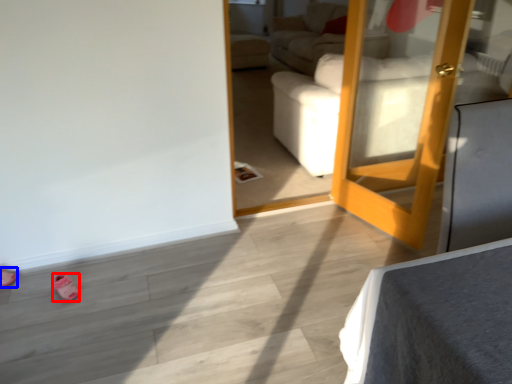
Question: Which object appears farthest to the camera in this image, shoe (highlighted by a red box) or shoe (highlighted by a blue box)?

Choices:
 (A) shoe
 (B) shoe

Answer: (B)